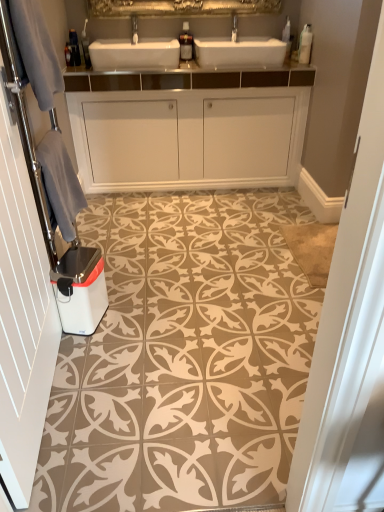
What is the approximate width of white textured towel at left?

It is 3.02 inches.

The height and width of the screenshot is (512, 384). What do you see at coordinates (196, 127) in the screenshot?
I see `white glossy cabinet at center` at bounding box center [196, 127].

What is the approximate height of brown textured tile at center?

It is 1.09 inches.

Image resolution: width=384 pixels, height=512 pixels. I want to click on gray fabric at left, so click(x=37, y=51).

From the image's perspective, who appears lower, brushed metal faucet at upper center or white textured towel at left?

white textured towel at left appears lower in the image.

What's the angular difference between brushed metal faucet at upper center and white textured towel at left's facing directions?

brushed metal faucet at upper center and white textured towel at left are facing 92.8 degrees away from each other.

Which of these two, brushed metal faucet at upper center or white textured towel at left, is smaller?

brushed metal faucet at upper center.

Is brushed metal faucet at upper center facing away from white textured towel at left?

No, brushed metal faucet at upper center's orientation is not away from white textured towel at left.

Which of these two, white glossy dishwasher at lower left or white glossy cabinet at center, is thinner?

Thinner between the two is white glossy dishwasher at lower left.

From the image's perspective, would you say white glossy dishwasher at lower left is shown under white glossy cabinet at center?

Yes, from the image's perspective, white glossy dishwasher at lower left is beneath white glossy cabinet at center.

Considering the relative positions of white glossy dishwasher at lower left and white glossy cabinet at center in the image provided, is white glossy dishwasher at lower left behind white glossy cabinet at center?

No, white glossy dishwasher at lower left is in front of white glossy cabinet at center.

Is white glossy dishwasher at lower left not close to white glossy cabinet at center?

Yes.

Considering the positions of points (54, 207) and (16, 28), is point (54, 207) closer to camera compared to point (16, 28)?

No.

Is gray fabric towel at left directly adjacent to gray fabric at left?

No, gray fabric towel at left is not next to gray fabric at left.

Which is correct: gray fabric towel at left is inside gray fabric at left, or outside of it?

gray fabric towel at left is not enclosed by gray fabric at left.

In the scene shown: Considering the sizes of gray fabric towel at left and gray fabric at left in the image, is gray fabric towel at left wider or thinner than gray fabric at left?

In the image, gray fabric towel at left appears to be wider than gray fabric at left.

Could you tell me if brushed metal faucet at upper center is turned towards white glossy dishwasher at lower left?

No, brushed metal faucet at upper center does not turn towards white glossy dishwasher at lower left.

From the image's perspective, which is above, brushed metal faucet at upper center or white glossy dishwasher at lower left?

brushed metal faucet at upper center appears higher in the image.

From a real-world perspective, who is located lower, brushed metal faucet at upper center or white glossy dishwasher at lower left?

white glossy dishwasher at lower left is physically lower.

Considering the relative sizes of gray fabric at left and white textured towel at left in the image provided, is gray fabric at left shorter than white textured towel at left?

Yes.

Between point (51, 62) and point (26, 151), which one is positioned behind?

Positioned behind is point (51, 62).

Is white textured towel at left at the back of gray fabric at left?

No, gray fabric at left's orientation is not away from white textured towel at left.

Looking at this image, is gray fabric at left positioned before white textured towel at left?

No, it is not.

This screenshot has height=512, width=384. I want to click on dish washer that appears on the left of white glossy cabinet at center, so click(80, 290).

Who is shorter, white glossy cabinet at center or white glossy dishwasher at lower left?

white glossy dishwasher at lower left.

Does white glossy cabinet at center have a greater width compared to white glossy dishwasher at lower left?

Yes.

Could you tell me if white glossy cabinet at center is turned towards white glossy dishwasher at lower left?

Yes, white glossy cabinet at center faces towards white glossy dishwasher at lower left.

Between white textured towel at left and brushed metal faucet at upper center, which one appears on the left side from the viewer's perspective?

Positioned to the left is white textured towel at left.

From the image's perspective, would you say white textured towel at left is positioned over brushed metal faucet at upper center?

No, from the image's perspective, white textured towel at left is not above brushed metal faucet at upper center.

From a real-world perspective, is white textured towel at left positioned above or below brushed metal faucet at upper center?

In terms of real-world spatial position, white textured towel at left is below brushed metal faucet at upper center.

Based on their sizes in the image, would you say white textured towel at left is bigger or smaller than brushed metal faucet at upper center?

white textured towel at left is bigger than brushed metal faucet at upper center.

The height and width of the screenshot is (512, 384). In the image, there is a brushed metal faucet at upper center. What are the coordinates of `door below it (from the image's perspective)` in the screenshot? It's located at (22, 289).

In the image, there is a white glossy cabinet at center. What are the coordinates of `dish washer below it (from a real-world perspective)` in the screenshot? It's located at (80, 290).

Based on their spatial positions, is white glossy dishwasher at lower left or gray fabric at left closer to white textured towel at left?

Among the two, white glossy dishwasher at lower left is located nearer to white textured towel at left.

Considering their positions, is gray fabric at left positioned further to brown textured tile at center than white glossy dishwasher at lower left?

gray fabric at left lies further to brown textured tile at center than the other object.

Considering their positions, is white glossy cabinet at center positioned further to white textured towel at left than brushed metal faucet at upper center?

brushed metal faucet at upper center is further to white textured towel at left.

Which object lies nearer to the anchor point white glossy cabinet at center, white glossy dishwasher at lower left or brown textured tile at center?

Based on the image, brown textured tile at center appears to be nearer to white glossy cabinet at center.

Which object lies further to the anchor point gray fabric towel at left, gray fabric at left or brushed metal faucet at upper center?

brushed metal faucet at upper center.

Estimate the real-world distances between objects in this image. Which object is further from gray fabric at left, brown textured tile at center or gray fabric towel at left?

brown textured tile at center is further to gray fabric at left.

Which object lies further to the anchor point gray fabric at left, gray fabric towel at left or white glossy cabinet at center?

Among the two, white glossy cabinet at center is located further to gray fabric at left.

When comparing their distances from white glossy cabinet at center, does brown textured tile at center or white textured towel at left seem closer?

Among the two, brown textured tile at center is located nearer to white glossy cabinet at center.

Identify the location of bathroom cabinet located between white textured towel at left and brushed metal faucet at upper center in the depth direction. (196, 127).

You are a GUI agent. You are given a task and a screenshot of the screen. Output one action in this format:
    pyautogui.click(x=<x>, y=<y>)
    Task: Click on the bathroom cabinet between brushed metal faucet at upper center and white glossy dishwasher at lower left in the up-down direction
    
    Given the screenshot: What is the action you would take?
    pyautogui.click(x=196, y=127)

The height and width of the screenshot is (512, 384). I want to click on gray located between white textured towel at left and gray fabric towel at left in the depth direction, so click(37, 51).

Identify the location of design between gray fabric at left and white glossy dishwasher at lower left in the vertical direction. The width and height of the screenshot is (384, 512). (184, 358).